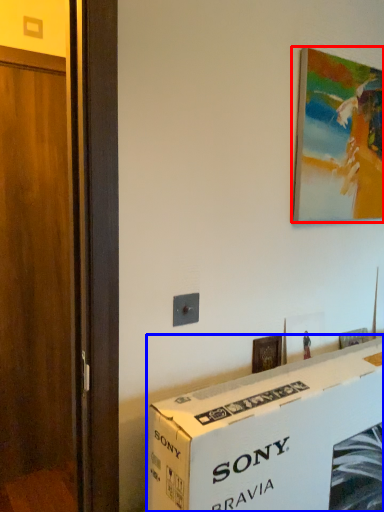
Question: Which object is further to the camera taking this photo, picture frame (highlighted by a red box) or box (highlighted by a blue box)?

Choices:
 (A) picture frame
 (B) box

Answer: (A)